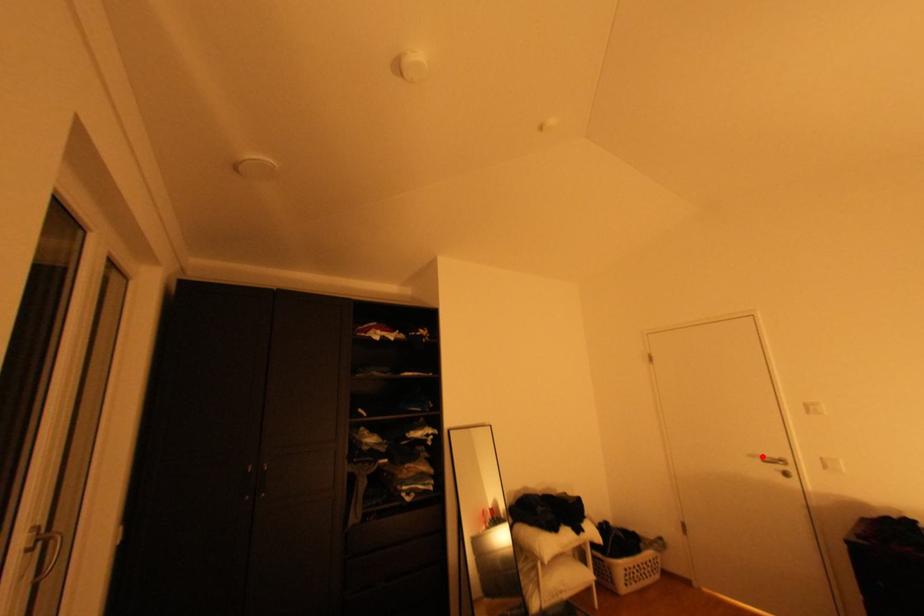
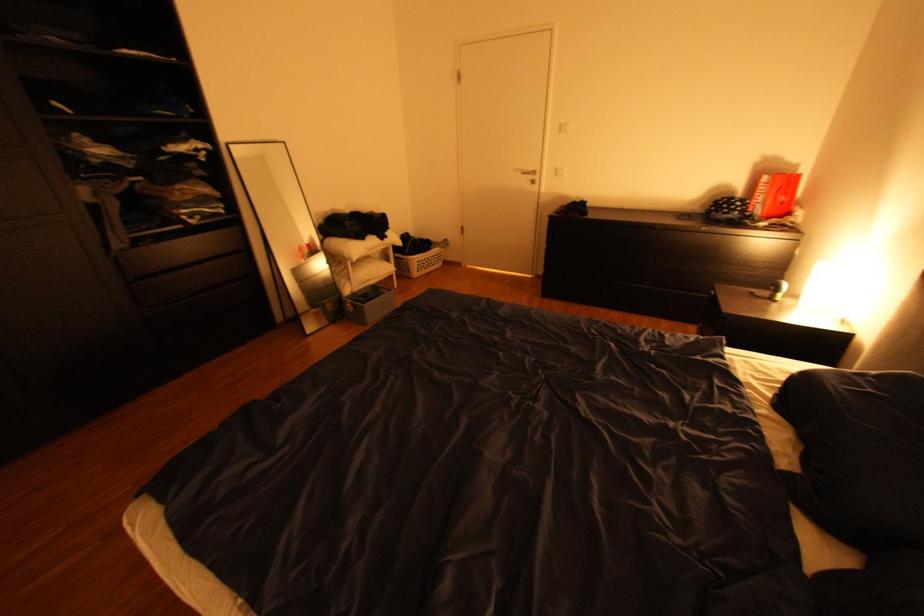
Find the pixel in the second image that matches the highlighted location in the first image.

(526, 171)